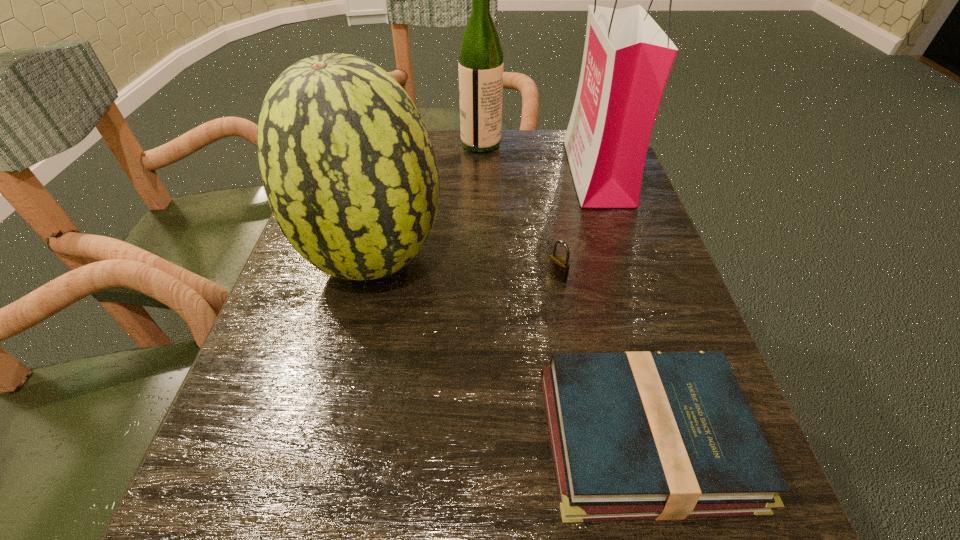
Identify the location of shopping bag. (627, 59).

Where is `liquor`? Image resolution: width=960 pixels, height=540 pixels. liquor is located at coordinates (480, 66).

Image resolution: width=960 pixels, height=540 pixels. In order to click on watermelon in this screenshot , I will do `click(350, 173)`.

Find the location of a particular element. This screenshot has width=960, height=540. the second shortest object is located at coordinates (558, 268).

The image size is (960, 540). Find the location of `hardback book`. hardback book is located at coordinates (642, 435).

Image resolution: width=960 pixels, height=540 pixels. In order to click on the nearest object in this screenshot , I will do `click(642, 435)`.

Locate an element on the screen. free space located 0.350m on the front-facing side of the shopping bag is located at coordinates (424, 172).

Find the location of a particular element. vacant region located 0.230m on the front-facing side of the shopping bag is located at coordinates pos(474,172).

You are a GUI agent. You are given a task and a screenshot of the screen. Output one action in this format:
    pyautogui.click(x=<x>, y=<y>)
    Task: Click on the free space located on the front-facing side of the shopping bag
    
    Given the screenshot: What is the action you would take?
    pyautogui.click(x=541, y=172)

The height and width of the screenshot is (540, 960). Identify the location of vacant space located on the label of the fourth object from right to left. (349, 144).